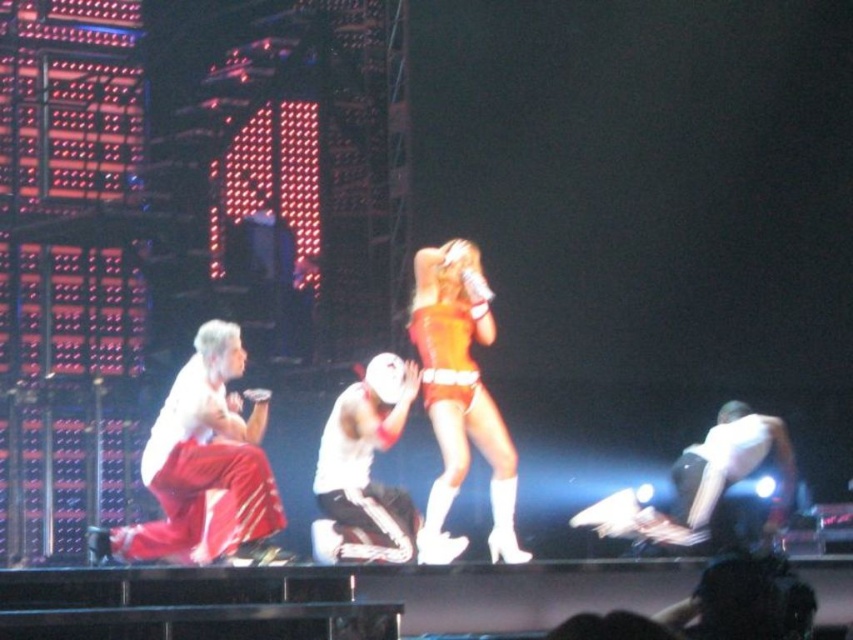
Is shiny red pants at left further to camera compared to white matte jersey at center?

No, shiny red pants at left is closer to the viewer.

Which is above, shiny red pants at left or white matte jersey at center?

white matte jersey at center

Does point (198, 413) come closer to viewer compared to point (384, 497)?

Yes, point (198, 413) is in front of point (384, 497).

What are the coordinates of `shiny red pants at left` in the screenshot? It's located at (206, 467).

Is point (444, 291) positioned behind point (398, 496)?

That is True.

Is shiny orange bodysuit at center thinner than white matte jersey at center?

No, shiny orange bodysuit at center is not thinner than white matte jersey at center.

Is point (491, 509) in front of point (372, 490)?

No, it is behind (372, 490).

I want to click on shiny orange bodysuit at center, so (x=459, y=400).

Who is more forward, (165, 400) or (506, 456)?

Point (506, 456) is in front.

Who is taller, shiny red pants at left or shiny orange bodysuit at center?

shiny orange bodysuit at center is taller.

Between point (264, 454) and point (490, 444), which one is positioned behind?

The point (264, 454) is behind.

This screenshot has width=853, height=640. What are the coordinates of `shiny red pants at left` in the screenshot? It's located at click(206, 467).